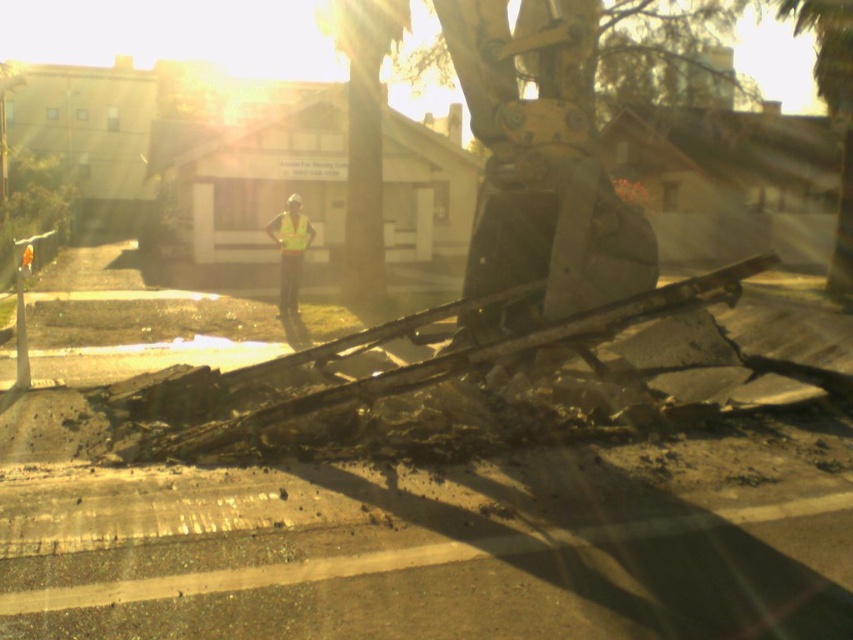
Question: Which of the following is the closest to the observer?

Choices:
 (A) (804, 12)
 (B) (399, 3)

Answer: (B)

Question: Is green leafy tree at upper right further to camera compared to yellow reflective vest at center?

Choices:
 (A) no
 (B) yes

Answer: (B)

Question: Which of the following is the farthest from the observer?

Choices:
 (A) (825, 45)
 (B) (271, 225)
 (C) (375, 288)

Answer: (A)

Question: Can you confirm if green leafy tree at center is positioned above green leafy tree at upper right?

Choices:
 (A) yes
 (B) no

Answer: (B)

Question: Which point is farther to the camera?

Choices:
 (A) (289, 224)
 (B) (354, 65)
 (C) (843, 244)

Answer: (C)

Question: Can you confirm if green leafy tree at upper right is positioned above yellow reflective vest at center?

Choices:
 (A) yes
 (B) no

Answer: (A)